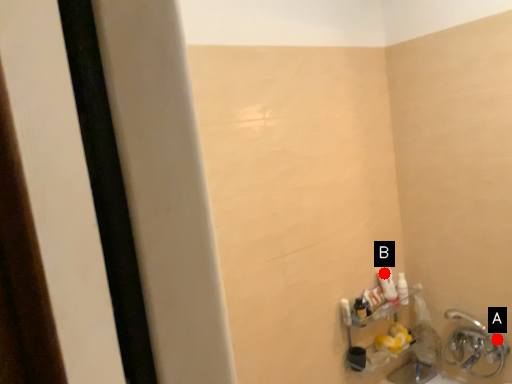
Question: Two points are circled on the image, labeled by A and B beside each circle. Which point is closer to the camera?

Choices:
 (A) A is closer
 (B) B is closer

Answer: (A)